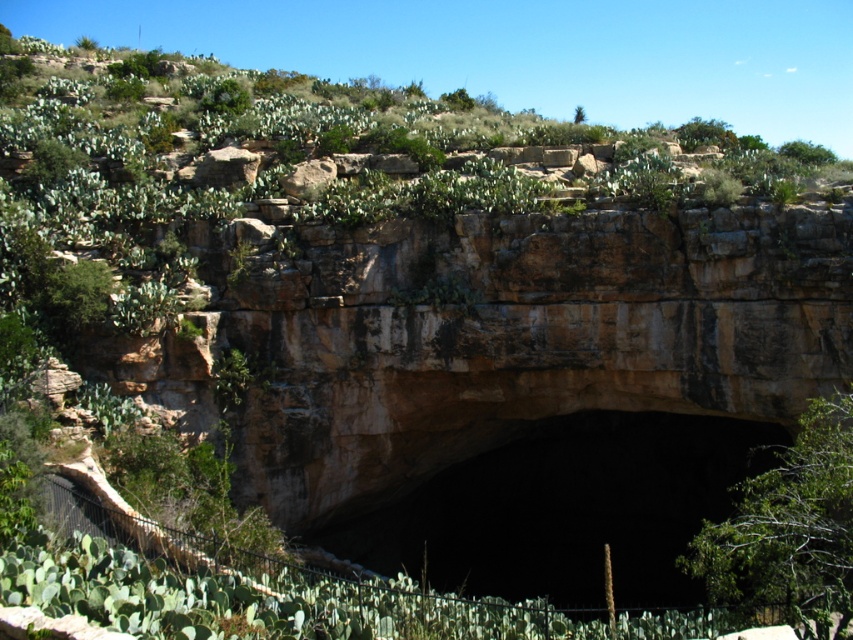
Who is more distant from viewer, (675, 531) or (761, 586)?

The point (675, 531) is behind.

Is point (636, 531) in front of point (817, 544)?

No, (636, 531) is behind (817, 544).

The image size is (853, 640). I want to click on dark brown stone cave at center, so click(567, 509).

Where is `dark brown stone cave at center`? The height and width of the screenshot is (640, 853). dark brown stone cave at center is located at coordinates (567, 509).